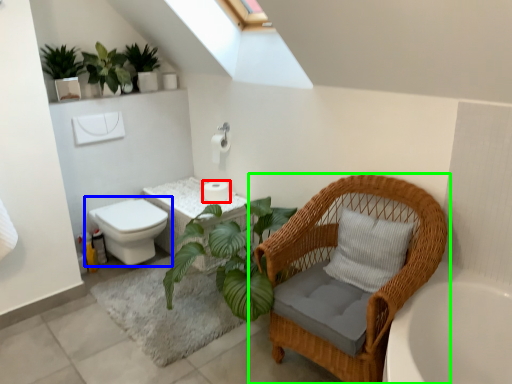
Question: Which object is positioned closest to toilet paper (highlighted by a red box)? Select from toilet (highlighted by a blue box) and chair (highlighted by a green box).

Choices:
 (A) toilet
 (B) chair

Answer: (A)